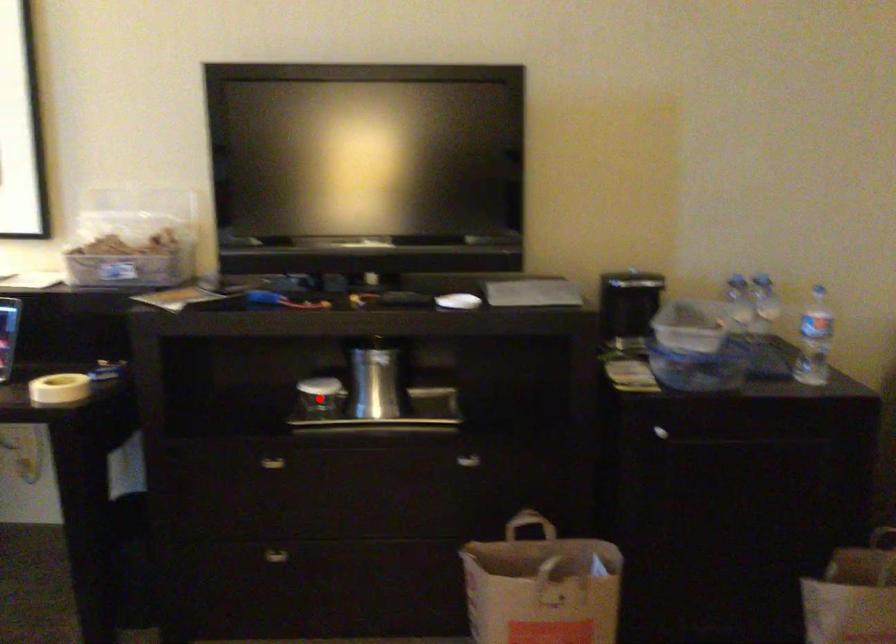
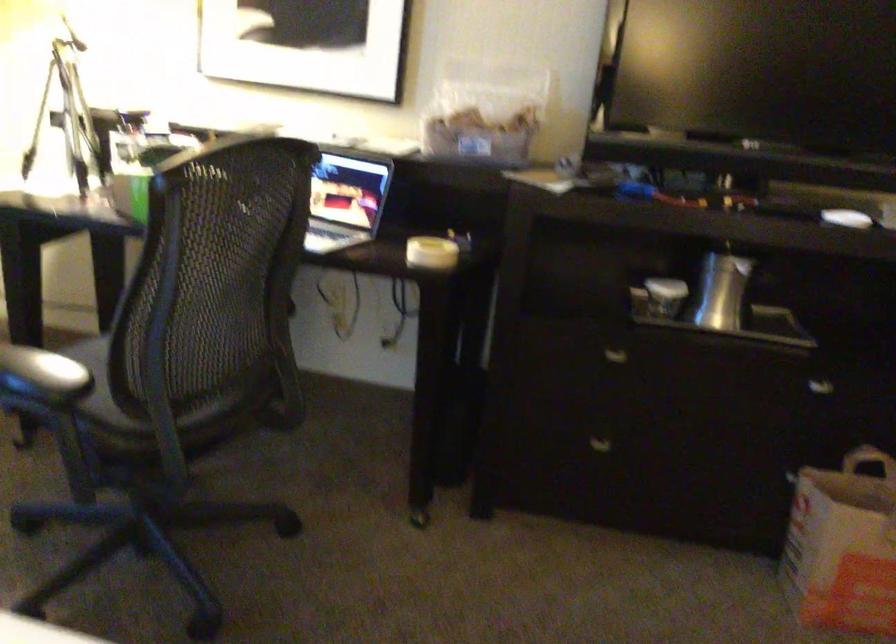
In the second image, find the point that corresponds to the highlighted location in the first image.

(666, 297)